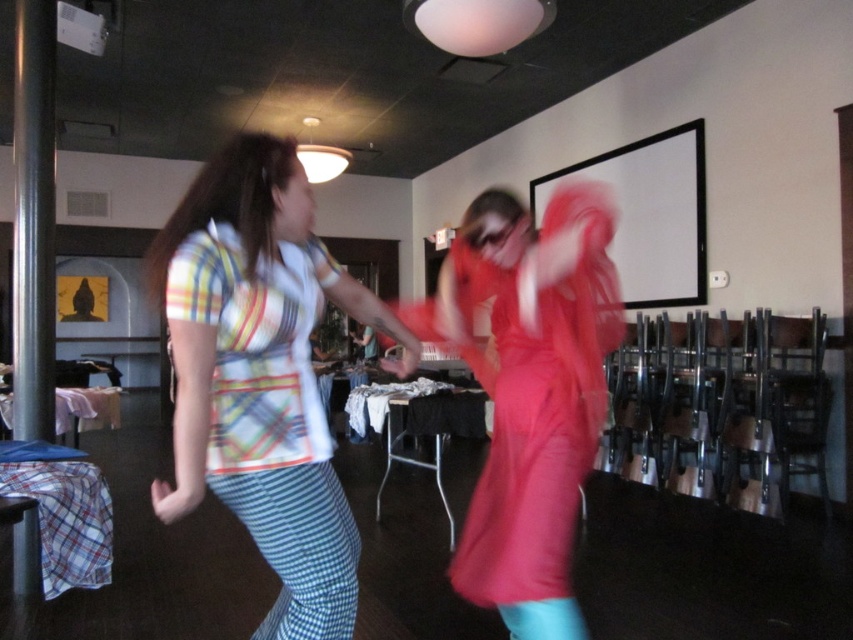
Question: Which point is closer to the camera taking this photo?

Choices:
 (A) (222, 316)
 (B) (531, 269)

Answer: (A)

Question: Which object is closer to the camera taking this photo?

Choices:
 (A) matte pink dress at center
 (B) striped cotton shirt at center

Answer: (B)

Question: Can you confirm if striped cotton shirt at center is positioned above matte pink dress at center?

Choices:
 (A) no
 (B) yes

Answer: (B)

Question: Is striped cotton shirt at center below matte pink dress at center?

Choices:
 (A) no
 (B) yes

Answer: (A)

Question: Does striped cotton shirt at center appear under matte pink dress at center?

Choices:
 (A) no
 (B) yes

Answer: (A)